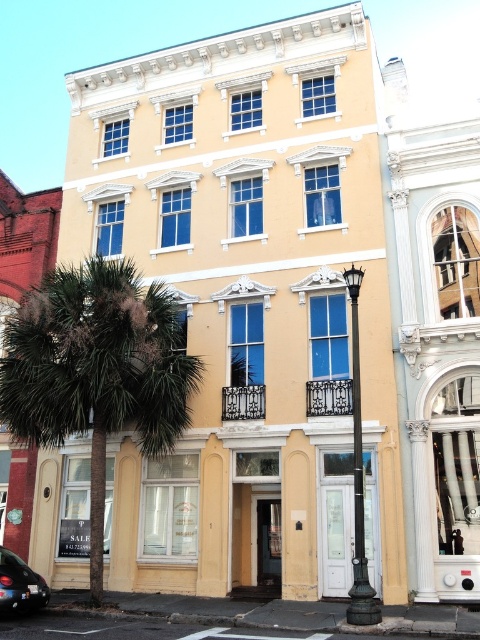
Is point (94, 476) positioned in front of point (12, 611)?

No.

Between green leafy palm tree at left and shiny black car at lower left, which one appears on the right side from the viewer's perspective?

Positioned to the right is green leafy palm tree at left.

Locate an element on the screen. The image size is (480, 640). green leafy palm tree at left is located at coordinates (96, 371).

Where is `green leafy palm tree at left`? This screenshot has width=480, height=640. green leafy palm tree at left is located at coordinates coord(96,371).